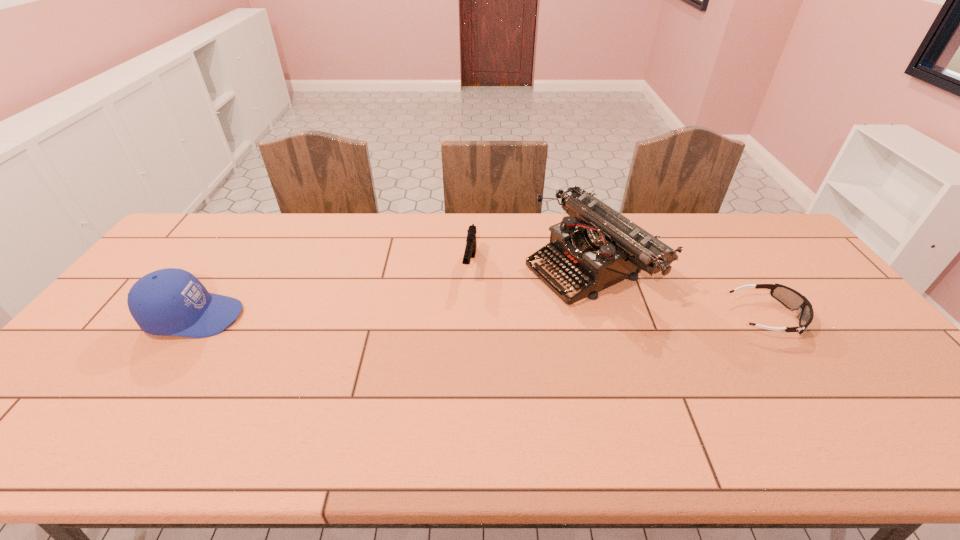
Find the location of `vacant space on the desktop that is between the leftmost object and the shortest object and is positioned on the keyboard of the tallest object`. vacant space on the desktop that is between the leftmost object and the shortest object and is positioned on the keyboard of the tallest object is located at coordinates (474, 316).

The image size is (960, 540). Identify the location of vacant space on the desktop that is between the leftmost object and the rightmost object and is positioned on the front-facing side of the second shortest object. (460, 316).